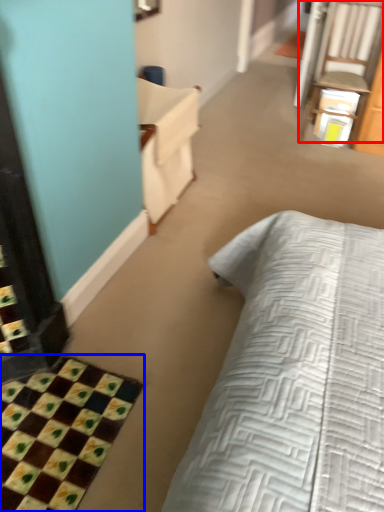
Question: Among these objects, which one is farthest to the camera, chair (highlighted by a red box) or bath mat (highlighted by a blue box)?

Choices:
 (A) chair
 (B) bath mat

Answer: (A)